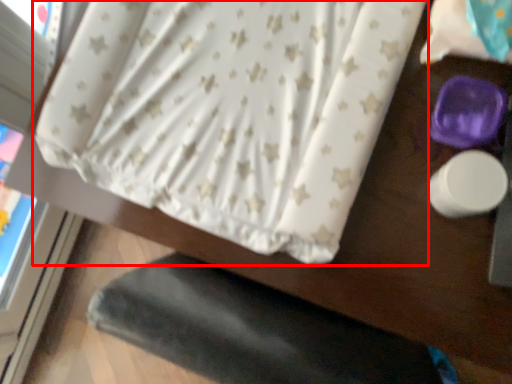
Question: From the image's perspective, where is curtain (annotated by the red box) located relative to sheet?

Choices:
 (A) below
 (B) above

Answer: (A)